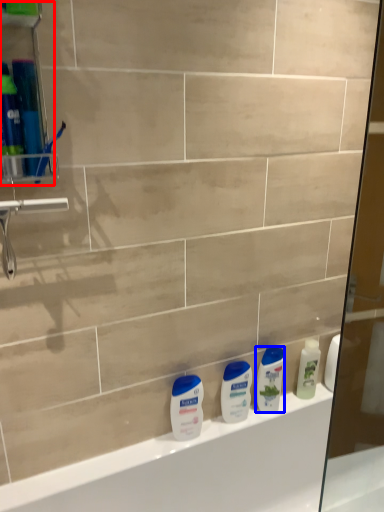
Question: Which of the following is the farthest to the observer, shelf (highlighted by a red box) or cleaning product (highlighted by a blue box)?

Choices:
 (A) shelf
 (B) cleaning product

Answer: (B)